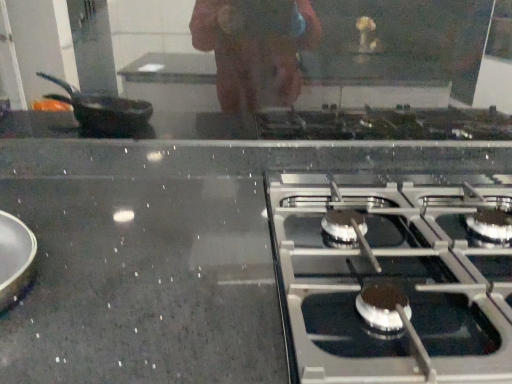
Describe the element at coordinates (390, 280) in the screenshot. I see `satin silver gas stove at center` at that location.

The height and width of the screenshot is (384, 512). Identify the location of satin silver gas stove at center. (390, 280).

Find the location of a particular element. satin silver gas stove at center is located at coordinates (390, 280).